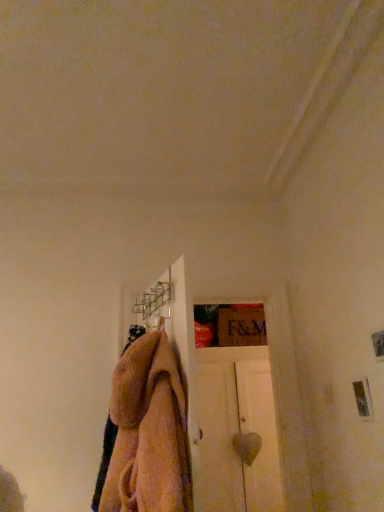
Describe the element at coordinates (235, 432) in the screenshot. The image size is (384, 512). I see `white matte door at center` at that location.

Measure the distance between point (272, 444) and camera.

They are 3.37 meters apart.

At what (x,y) coordinates should I click in order to perform the action: click on white matte door at center. Please return your answer as a coordinate pair (x, y). Looking at the image, I should click on (235, 432).

The width and height of the screenshot is (384, 512). I want to click on beige fuzzy towel at center-left, so click(x=145, y=432).

This screenshot has height=512, width=384. Describe the element at coordinates (145, 432) in the screenshot. I see `beige fuzzy towel at center-left` at that location.

What is the approximate width of beige fuzzy towel at center-left?

beige fuzzy towel at center-left is 11.90 inches in width.

Where is `white matte door at center`? Image resolution: width=384 pixels, height=512 pixels. white matte door at center is located at coordinates (235, 432).

Is beige fuzzy towel at center-left to the left of white matte door at center from the viewer's perspective?

Correct, you'll find beige fuzzy towel at center-left to the left of white matte door at center.

Which object is more forward, beige fuzzy towel at center-left or white matte door at center?

beige fuzzy towel at center-left is closer to the camera.

Is point (163, 417) less distant than point (233, 499)?

Yes, point (163, 417) is in front of point (233, 499).

From the image's perspective, is beige fuzzy towel at center-left located above or below white matte door at center?

From the image's perspective, beige fuzzy towel at center-left appears above white matte door at center.

From a real-world perspective, which object rests below the other?

white matte door at center is physically lower.

Is beige fuzzy towel at center-left wider or thinner than white matte door at center?

In the image, beige fuzzy towel at center-left appears to be more narrow than white matte door at center.

Considering the sizes of objects beige fuzzy towel at center-left and white matte door at center in the image provided, who is shorter, beige fuzzy towel at center-left or white matte door at center?

beige fuzzy towel at center-left is shorter.

Is beige fuzzy towel at center-left bigger or smaller than white matte door at center?

Considering their sizes, beige fuzzy towel at center-left takes up less space than white matte door at center.

Is beige fuzzy towel at center-left located outside white matte door at center?

Absolutely, beige fuzzy towel at center-left is external to white matte door at center.

Is beige fuzzy towel at center-left not close to white matte door at center?

Absolutely, beige fuzzy towel at center-left is distant from white matte door at center.

Could you tell me if beige fuzzy towel at center-left is facing white matte door at center?

No, beige fuzzy towel at center-left is not oriented towards white matte door at center.

How different are the orientations of beige fuzzy towel at center-left and white matte door at center in degrees?

The angle between the facing direction of beige fuzzy towel at center-left and the facing direction of white matte door at center is 73.7 degrees.

Locate an element on the screen. towel lying on the left of white matte door at center is located at coordinates (145, 432).

Does white matte door at center appear on the right side of beige fuzzy towel at center-left?

Yes.

Is the depth of white matte door at center greater than that of beige fuzzy towel at center-left?

Yes, it is behind beige fuzzy towel at center-left.

Considering the positions of point (235, 474) and point (157, 484), is point (235, 474) closer or farther from the camera than point (157, 484)?

Point (235, 474) is farther from the camera than point (157, 484).

From the image's perspective, which object appears higher, white matte door at center or beige fuzzy towel at center-left?

beige fuzzy towel at center-left appears higher in the image.

From a real-world perspective, is white matte door at center physically above beige fuzzy towel at center-left?

No, from a real-world perspective, white matte door at center is not over beige fuzzy towel at center-left

Is white matte door at center wider than beige fuzzy towel at center-left?

Indeed, white matte door at center has a greater width compared to beige fuzzy towel at center-left.

Does white matte door at center have a greater height compared to beige fuzzy towel at center-left?

Indeed, white matte door at center has a greater height compared to beige fuzzy towel at center-left.

Looking at the image, does white matte door at center seem bigger or smaller compared to beige fuzzy towel at center-left?

white matte door at center is bigger than beige fuzzy towel at center-left.

Is white matte door at center not inside beige fuzzy towel at center-left?

That's correct, white matte door at center is outside of beige fuzzy towel at center-left.

In the scene shown: Is white matte door at center placed right next to beige fuzzy towel at center-left?

white matte door at center and beige fuzzy towel at center-left are clearly separated.

Is white matte door at center facing away from beige fuzzy towel at center-left?

white matte door at center is not turned away from beige fuzzy towel at center-left.

Can you tell me how much white matte door at center and beige fuzzy towel at center-left differ in facing direction?

They differ by 73.7 degrees in their facing directions.

Measure the distance between white matte door at center and beige fuzzy towel at center-left.

The distance of white matte door at center from beige fuzzy towel at center-left is 5.82 feet.

Find the location of a particular element. towel in front of the white matte door at center is located at coordinates (145, 432).

Find the location of `door on the right side of beige fuzzy towel at center-left`. door on the right side of beige fuzzy towel at center-left is located at coordinates (235, 432).

Where is `towel located above the white matte door at center (from the image's perspective)`? The image size is (384, 512). towel located above the white matte door at center (from the image's perspective) is located at coordinates (145, 432).